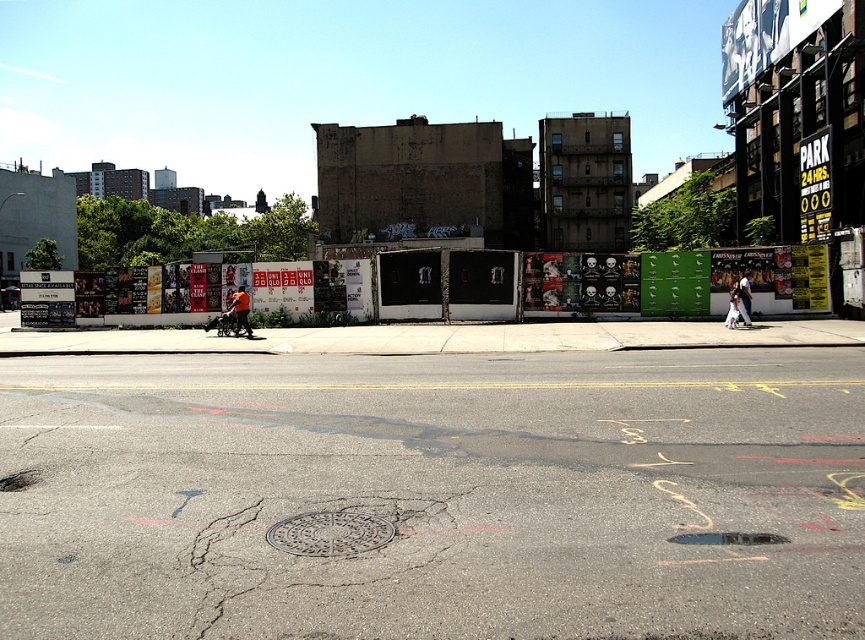
Who is more forward, (241, 308) or (748, 314)?

Point (241, 308)

Which of these two, orange fabric stroller at center or white cotton shirt at center, stands taller?

orange fabric stroller at center is taller.

Locate an element on the screen. The height and width of the screenshot is (640, 865). orange fabric stroller at center is located at coordinates (240, 310).

Where is `orange fabric stroller at center`? Image resolution: width=865 pixels, height=640 pixels. orange fabric stroller at center is located at coordinates (240, 310).

Does cracked asphalt at center appear on the left side of orange fabric stroller at center?

Incorrect, cracked asphalt at center is not on the left side of orange fabric stroller at center.

Can you confirm if cracked asphalt at center is shorter than orange fabric stroller at center?

Yes.

Which is in front, point (424, 564) or point (241, 296)?

Point (424, 564)

Find the location of `cracked asphalt at center`. cracked asphalt at center is located at coordinates (321, 566).

Where is `cracked asphalt at center`? cracked asphalt at center is located at coordinates (321, 566).

Between cracked asphalt at center and white cotton shirt at center, which one has more height?

white cotton shirt at center is taller.

Describe the element at coordinates (321, 566) in the screenshot. I see `cracked asphalt at center` at that location.

What are the coordinates of `cracked asphalt at center` in the screenshot? It's located at (321, 566).